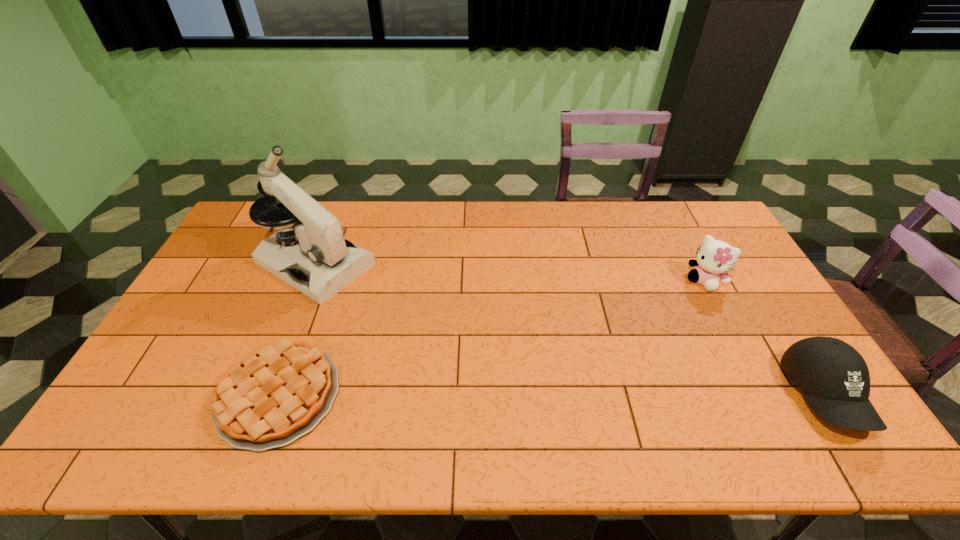
The image size is (960, 540). What are the coordinates of `vacant point located between the third object from left to right and the pie` in the screenshot? It's located at (492, 338).

You are a GUI agent. You are given a task and a screenshot of the screen. Output one action in this format:
    pyautogui.click(x=<x>, y=<y>)
    Task: Click on the free space between the pie and the kitten
    This screenshot has width=960, height=540.
    Given the screenshot: What is the action you would take?
    pyautogui.click(x=492, y=338)

The height and width of the screenshot is (540, 960). What are the coordinates of `vacant point located between the shortest object and the microscope` in the screenshot? It's located at 298,329.

Where is `free space between the pie and the kitten`? The height and width of the screenshot is (540, 960). free space between the pie and the kitten is located at coordinates (492, 338).

The width and height of the screenshot is (960, 540). I want to click on empty space that is in between the pie and the second shortest object, so click(x=552, y=395).

Select which object appears as the closest to the rightmost object. Please provide its 2D coordinates. Your answer should be formatted as a tuple, i.e. [(x, y)], where the tuple contains the x and y coordinates of a point satisfying the conditions above.

[(714, 258)]

In order to click on object that stands as the closest to the third shortest object in this screenshot , I will do `click(835, 379)`.